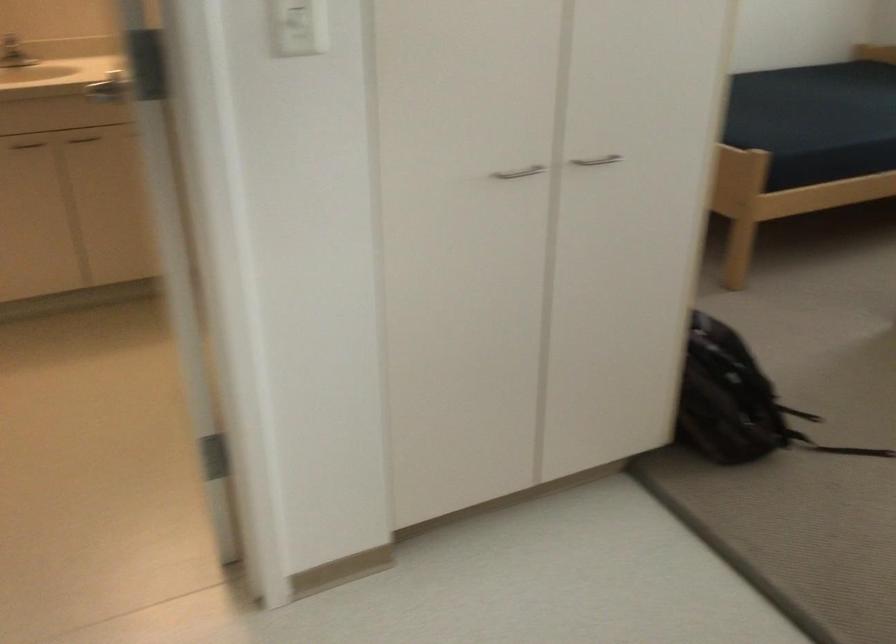
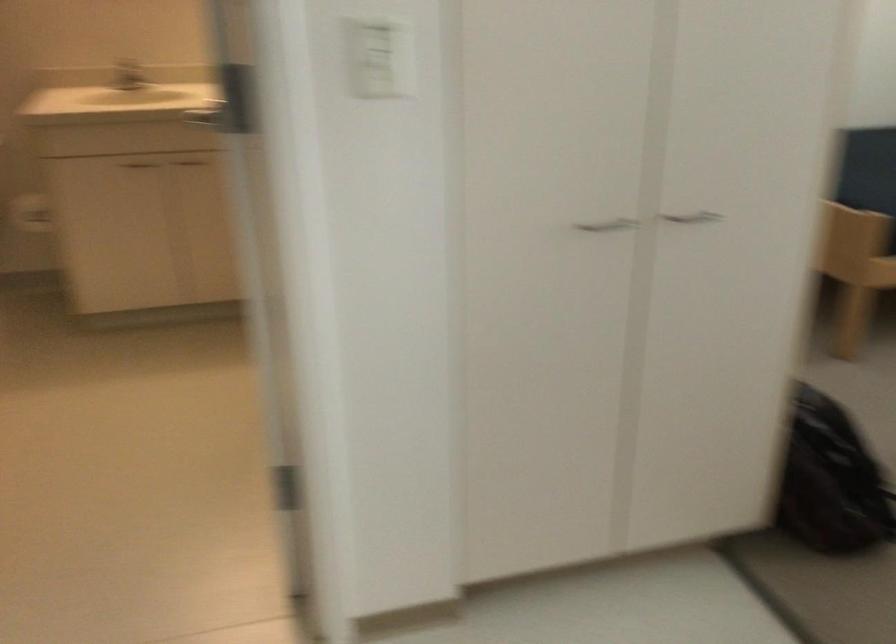
Where in the second image is the point corresponding to point (737, 204) from the first image?

(855, 269)